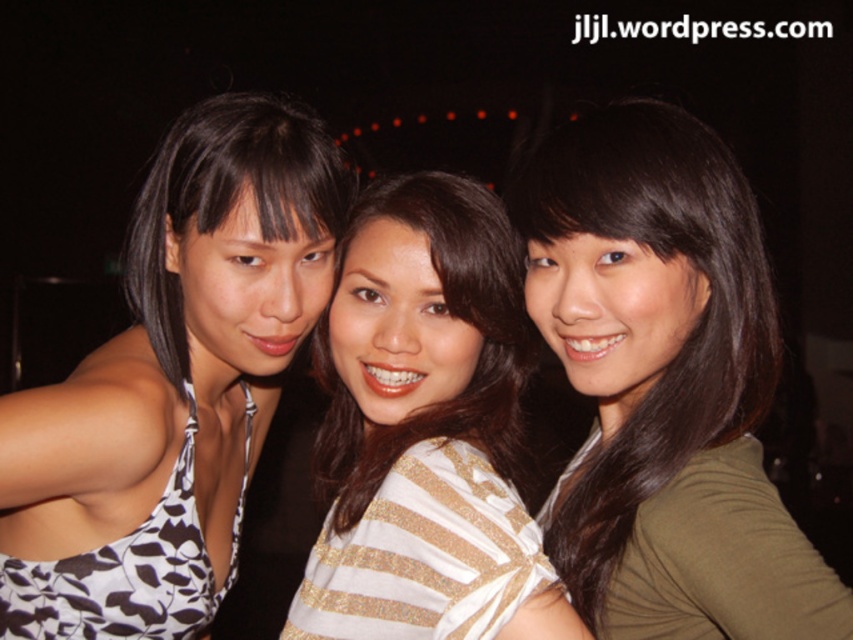
You are taking a photo of three people standing in a line. You notice two points marked on the photo at coordinates point (277, 332) and point (428, 285). Which point is closer to the camera?

Point (277, 332) is further to the camera than point (428, 285), so the point closer to the camera is point (428, 285).

You are organizing a charity event and need to arrange seating for two guests wearing the matte olive green shirt at center and the white printed dress at left. If the seating area has chairs with a standard width of 45 cm, can both guests sit comfortably side by side?

The matte olive green shirt at center is smaller in size than the white printed dress at left. Since the dress is larger, it may require more space. However, without specific measurements, it is uncertain if both will fit comfortably in 45 cm chairs. Consider arranging chairs with wider seats or spacing them further apart.